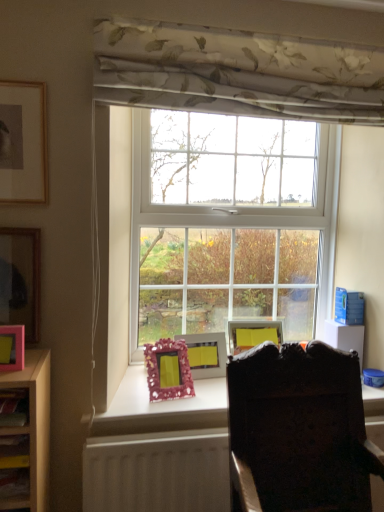
Question: Is pink matte picture frame at left, the second picture frame from the top, in front of or behind matte pink shelf at lower left in the image?

Choices:
 (A) behind
 (B) front

Answer: (A)

Question: In terms of size, does pink matte picture frame at left, acting as the first picture frame starting from the left, appear bigger or smaller than matte pink shelf at lower left?

Choices:
 (A) big
 (B) small

Answer: (A)

Question: Estimate the real-world distances between objects in this image. Which object is farther from the pink glittery picture frame at center, the 1th picture frame in the bottom-to-top sequence?

Choices:
 (A) dark wood desk at lower center
 (B) pink glossy picture frame at left, the third picture frame ordered from the bottom
 (C) matte gold picture frame at upper left, acting as the 2th picture frame starting from the left
 (D) pink matte picture frame at left, marked as the fifth picture frame in a right-to-left arrangement
 (E) matte pink shelf at lower left

Answer: (C)

Question: Which is farther from the dark wood chair at center?

Choices:
 (A) pink glossy picture frame at left, the first picture frame when ordered from front to back
 (B) pink matte picture frame at left, acting as the first picture frame starting from the left
 (C) dark wood desk at lower center
 (D) pink glittery picture frame at center, the fifth picture frame viewed from the top
 (E) matte pink shelf at lower left

Answer: (B)